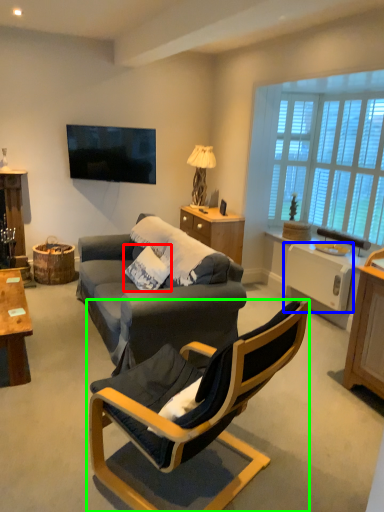
Question: Estimate the real-world distances between objects in this image. Which object is closer to pillow (highlighted by a red box), appliance (highlighted by a blue box) or chair (highlighted by a green box)?

Choices:
 (A) appliance
 (B) chair

Answer: (B)